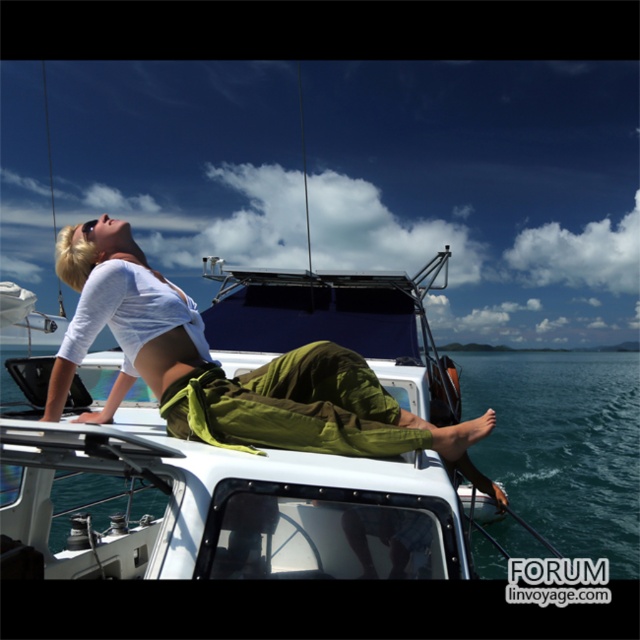
In the scene shown: Can you confirm if matte white shirt at upper left is thinner than clear blue water at upper center?

Indeed, matte white shirt at upper left has a lesser width compared to clear blue water at upper center.

Does matte white shirt at upper left have a greater width compared to clear blue water at upper center?

No, matte white shirt at upper left is not wider than clear blue water at upper center.

Does point (308, 376) come closer to viewer compared to point (532, 472)?

That is True.

In order to click on matte white shirt at upper left in this screenshot , I will do `click(236, 376)`.